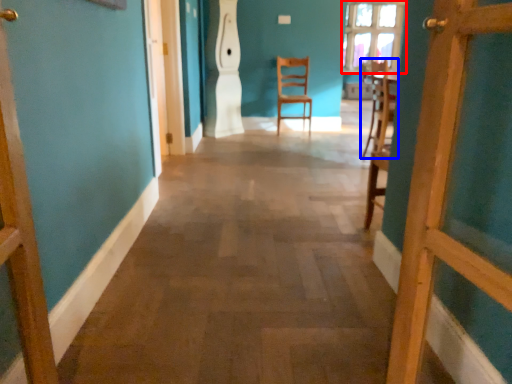
Question: Which object appears farthest to the camera in this image, window (highlighted by a red box) or chair (highlighted by a blue box)?

Choices:
 (A) window
 (B) chair

Answer: (A)